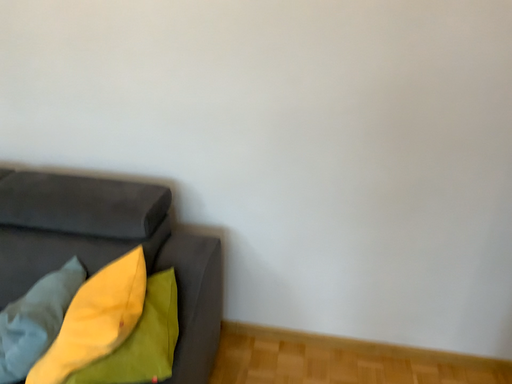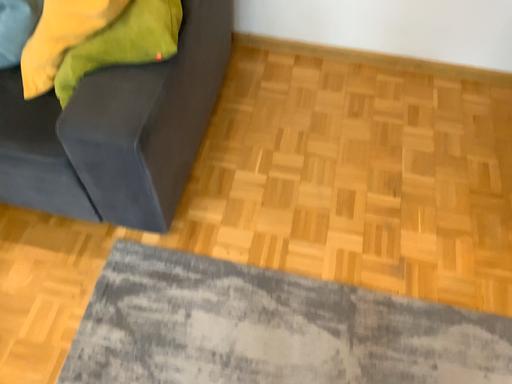
Question: How did the camera likely rotate when shooting the video?

Choices:
 (A) rotated downward
 (B) rotated upward

Answer: (A)